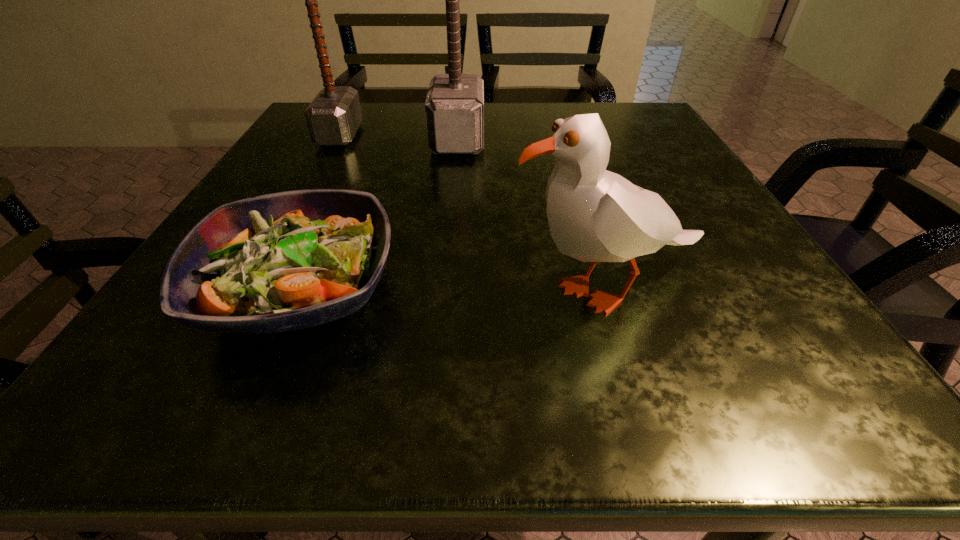
Locate an element on the screen. The width and height of the screenshot is (960, 540). vacant space located on the back of the salad plate is located at coordinates (369, 135).

I want to click on object that is at the near edge, so click(x=285, y=261).

I want to click on hammer situated at the left edge, so click(333, 117).

Locate an element on the screen. salad plate that is at the left edge is located at coordinates (285, 261).

At what (x,y) coordinates should I click in order to perform the action: click on object that is at the right edge. Please return your answer as a coordinate pair (x, y). The height and width of the screenshot is (540, 960). Looking at the image, I should click on (594, 215).

Where is `object present at the far left corner`? The width and height of the screenshot is (960, 540). object present at the far left corner is located at coordinates (333, 117).

Where is `object at the near left corner`? object at the near left corner is located at coordinates (285, 261).

I want to click on vacant area at the far edge of the desktop, so click(x=495, y=107).

The image size is (960, 540). In the image, there is a desktop. Identify the location of vacant area at the left edge. (142, 340).

What are the coordinates of `vacant space at the right edge of the desktop` in the screenshot? It's located at (660, 185).